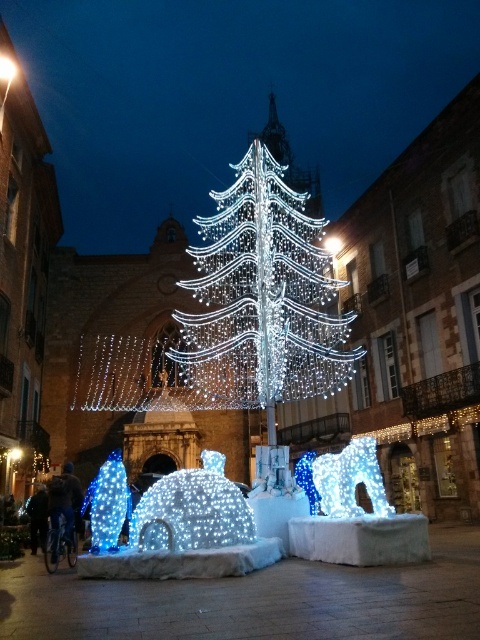
You are an architect designing a new public square and want to place a statue between the illuminated wireframe tree at center and the icy white dome at center. If the statue requires a 3 meter wide space, can it fit between them?

The illuminated wireframe tree at center is wider than the icy white dome at center. However, the description does not provide specific measurements of their widths or the distance between them. Without knowing the exact dimensions, it is impossible to determine if the 3 meter wide space is available.

In the scene shown: You are an event planner setting up for a winter festival. You need to ensure that the illuminated wireframe tree at center and the icy white sculpture at center are positioned correctly according to the design plan. Based on the scene description, which object is placed higher in the square?

The illuminated wireframe tree at center is positioned above the icy white sculpture at center, so it is placed higher in the square.